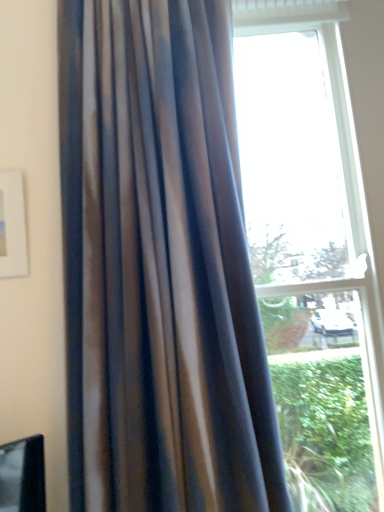
Where is `satin fabric curtain at center`? satin fabric curtain at center is located at coordinates (159, 267).

Image resolution: width=384 pixels, height=512 pixels. Describe the element at coordinates (159, 267) in the screenshot. I see `satin fabric curtain at center` at that location.

What are the coordinates of `satin fabric curtain at center` in the screenshot? It's located at (159, 267).